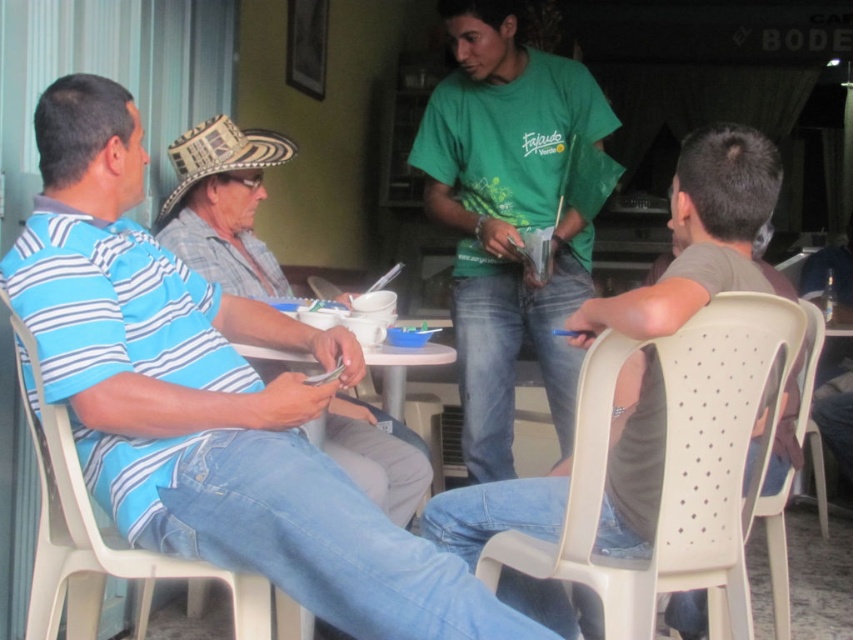
Looking at this image, you are sitting at the table and want to pass a card to the person in the blue striped shirt at left. Since you are facing the white plastic chair at left, which direction should you turn to reach them?

The blue striped shirt at left is to the right of the white plastic chair at left, so you should turn to your right to reach them.

Based on the scene description, where is the green cotton shirt at center located in terms of coordinates?

The green cotton shirt at center is located at coordinates point (508, 216).

You are a photographer standing in front of the scene. You want to take a photo of the blue striped shirt at left and the white plastic chair at left. Which one will appear larger in the photo?

The blue striped shirt at left will appear larger in the photo because it is closer to the viewer than the white plastic chair at left.